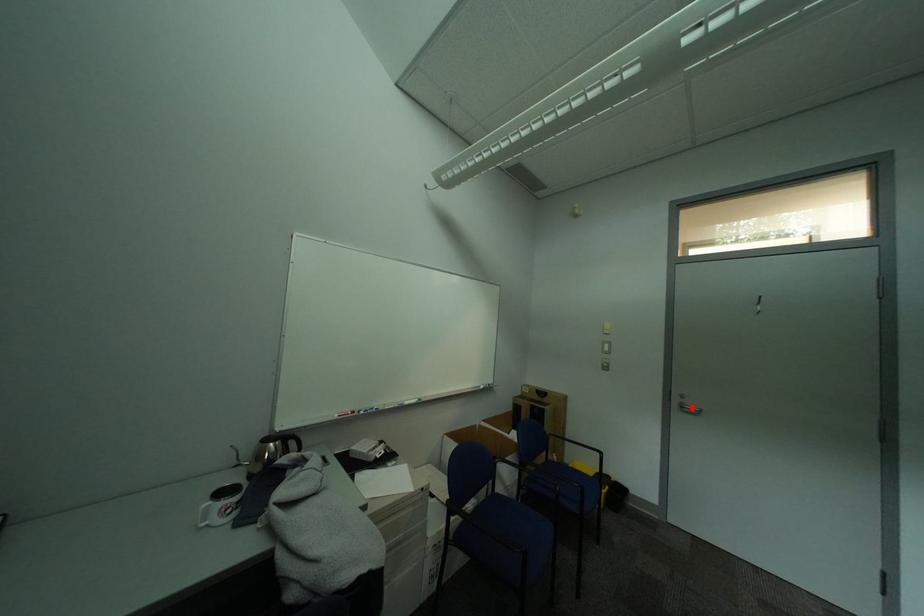
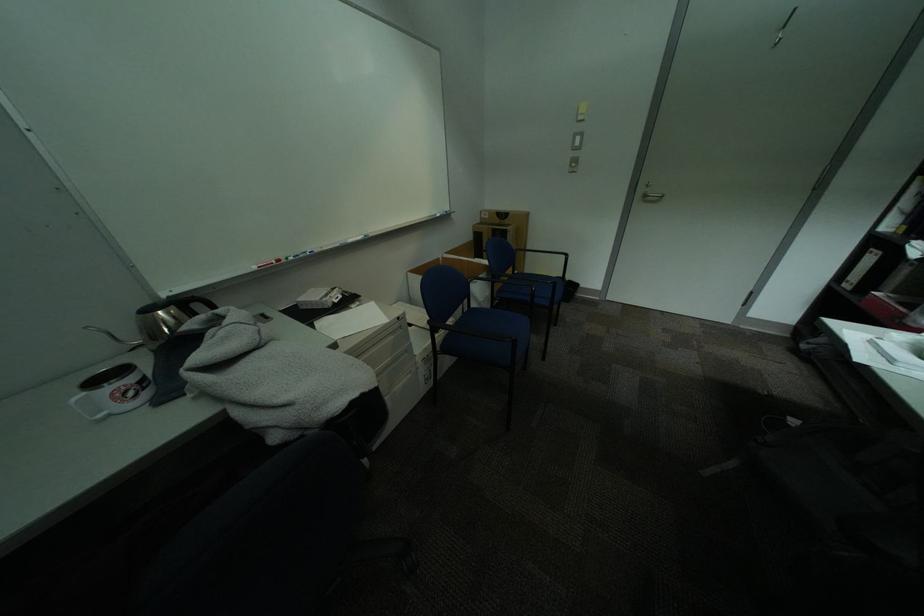
Locate, in the second image, the point that corresponds to the highlighted location in the first image.

(655, 197)